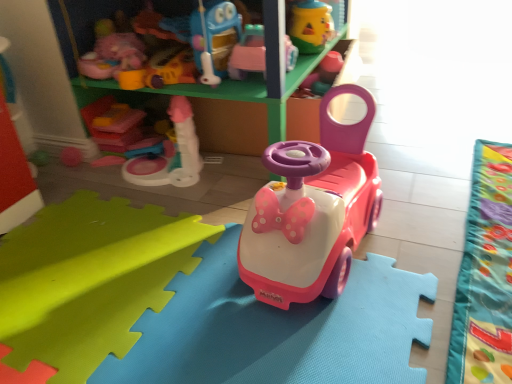
Question: Which direction should I rotate to look at matte pink plastic toy at center, the 5th toy positioned from the right?

Choices:
 (A) right
 (B) left

Answer: (B)

Question: Is matte pink plastic walker at upper center, which is the fourth toy from right to left, thinner than pink plastic toy car at center, positioned as the fourth toy in left-to-right order?

Choices:
 (A) yes
 (B) no

Answer: (B)

Question: From the image's perspective, is matte pink plastic walker at upper center, the second toy viewed from the left, below pink plastic toy car at center, positioned as the fourth toy in left-to-right order?

Choices:
 (A) no
 (B) yes

Answer: (A)

Question: Does matte pink plastic walker at upper center, the second toy viewed from the left, lie behind pink plastic toy car at center, which is the second toy in right-to-left order?

Choices:
 (A) yes
 (B) no

Answer: (A)

Question: Does matte pink plastic walker at upper center, the second toy viewed from the left, come in front of pink plastic toy car at center, which is the second toy in right-to-left order?

Choices:
 (A) no
 (B) yes

Answer: (A)

Question: Is matte pink plastic walker at upper center, which is the fourth toy from right to left, aimed at pink plastic toy car at center, which is the second toy in right-to-left order?

Choices:
 (A) yes
 (B) no

Answer: (B)

Question: Are matte pink plastic walker at upper center, the second toy viewed from the left, and pink plastic toy car at center, positioned as the fourth toy in left-to-right order, making contact?

Choices:
 (A) no
 (B) yes

Answer: (A)

Question: Would you say matte pink plastic walker at upper center, the second toy viewed from the left, is outside pink plastic toy car at center, arranged as the 3th toy when viewed from the left?

Choices:
 (A) no
 (B) yes

Answer: (B)

Question: Considering the relative sizes of matte pink plastic walker at upper center, which is the fourth toy from right to left, and pink plastic toy car at center, the 3th toy viewed from the right, in the image provided, is matte pink plastic walker at upper center, which is the fourth toy from right to left, bigger than pink plastic toy car at center, the 3th toy viewed from the right,?

Choices:
 (A) no
 (B) yes

Answer: (B)

Question: Does matte pink plastic walker at upper center, the second toy viewed from the left, come in front of pink plastic toy car at center, the 3th toy viewed from the right?

Choices:
 (A) yes
 (B) no

Answer: (A)

Question: Considering the relative sizes of matte pink plastic walker at upper center, the second toy viewed from the left, and pink plastic toy car at center, arranged as the 3th toy when viewed from the left, in the image provided, is matte pink plastic walker at upper center, the second toy viewed from the left, wider than pink plastic toy car at center, arranged as the 3th toy when viewed from the left,?

Choices:
 (A) no
 (B) yes

Answer: (B)

Question: Is matte pink plastic walker at upper center, which is the fourth toy from right to left, next to pink plastic toy car at center, the 3th toy viewed from the right, and touching it?

Choices:
 (A) no
 (B) yes

Answer: (B)

Question: Can you confirm if matte pink plastic walker at upper center, which is the fourth toy from right to left, is positioned to the left of pink plastic toy car at center, arranged as the 3th toy when viewed from the left?

Choices:
 (A) no
 (B) yes

Answer: (B)

Question: Would you say pink plastic toy car at center, arranged as the 3th toy when viewed from the left, is part of velvet green blanket at lower right's contents?

Choices:
 (A) yes
 (B) no

Answer: (B)